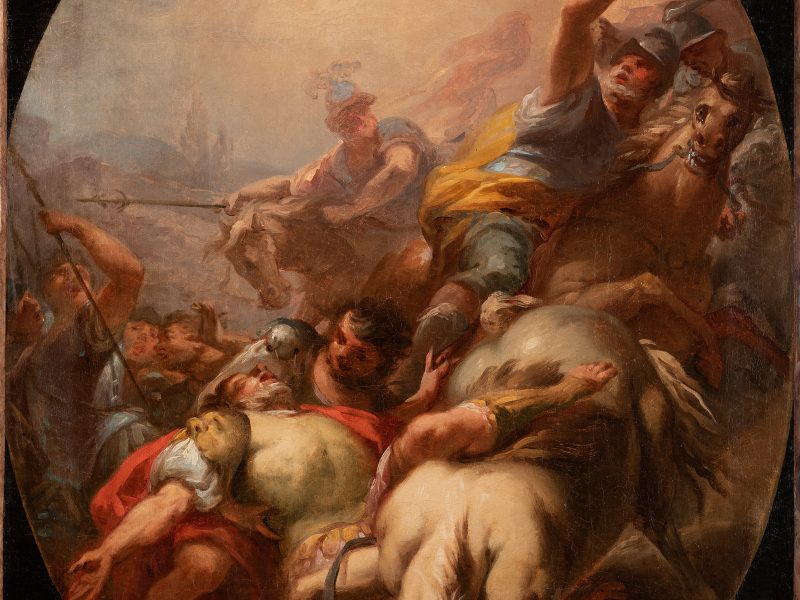
Locate an element on the screen. The height and width of the screenshot is (600, 800). art work is located at coordinates (368, 101).